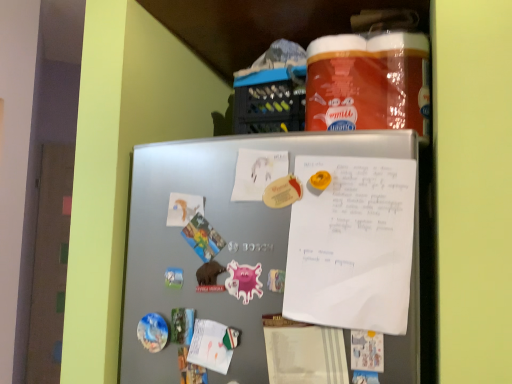
Question: Does white paper at upper center have a lesser width compared to satin silver fridge at center?

Choices:
 (A) no
 (B) yes

Answer: (B)

Question: Is white paper at upper center further to the viewer compared to satin silver fridge at center?

Choices:
 (A) yes
 (B) no

Answer: (A)

Question: Does white paper at upper center have a larger size compared to satin silver fridge at center?

Choices:
 (A) yes
 (B) no

Answer: (B)

Question: From the image's perspective, is white paper at upper center below satin silver fridge at center?

Choices:
 (A) no
 (B) yes

Answer: (A)

Question: Is white paper at upper center to the left of satin silver fridge at center from the viewer's perspective?

Choices:
 (A) no
 (B) yes

Answer: (A)

Question: Which is correct: white matte paper at center, the 1th paper when ordered from top to bottom, is inside white paper at upper center, or outside of it?

Choices:
 (A) inside
 (B) outside

Answer: (B)

Question: Is white matte paper at center, the first paper from the right, to the left or to the right of white paper at upper center in the image?

Choices:
 (A) right
 (B) left

Answer: (B)

Question: From the image's perspective, is white matte paper at center, acting as the 2th paper starting from the left, positioned above or below white paper at upper center?

Choices:
 (A) below
 (B) above

Answer: (B)

Question: Looking at their shapes, would you say white matte paper at center, the first paper from the right, is wider or thinner than white paper at upper center?

Choices:
 (A) thin
 (B) wide

Answer: (A)

Question: Is white matte paper at center, acting as the second paper starting from the bottom, inside or outside of white matte paper at upper left, which appears as the second paper when viewed from the right?

Choices:
 (A) inside
 (B) outside

Answer: (B)

Question: Would you say white matte paper at center, acting as the 2th paper starting from the left, is to the left or to the right of white matte paper at upper left, which appears as the second paper when viewed from the right, in the picture?

Choices:
 (A) left
 (B) right

Answer: (B)

Question: Considering the positions of point (239, 152) and point (177, 213), is point (239, 152) closer or farther from the camera than point (177, 213)?

Choices:
 (A) farther
 (B) closer

Answer: (B)

Question: In terms of height, does white matte paper at center, acting as the second paper starting from the bottom, look taller or shorter compared to white matte paper at upper left, which is counted as the 1th paper, starting from the bottom?

Choices:
 (A) tall
 (B) short

Answer: (A)

Question: Looking at their shapes, would you say white matte paper at center, acting as the 2th paper starting from the left, is wider or thinner than satin silver fridge at center?

Choices:
 (A) wide
 (B) thin

Answer: (B)

Question: From a real-world perspective, relative to satin silver fridge at center, is white matte paper at center, acting as the second paper starting from the bottom, vertically above or below?

Choices:
 (A) above
 (B) below

Answer: (A)